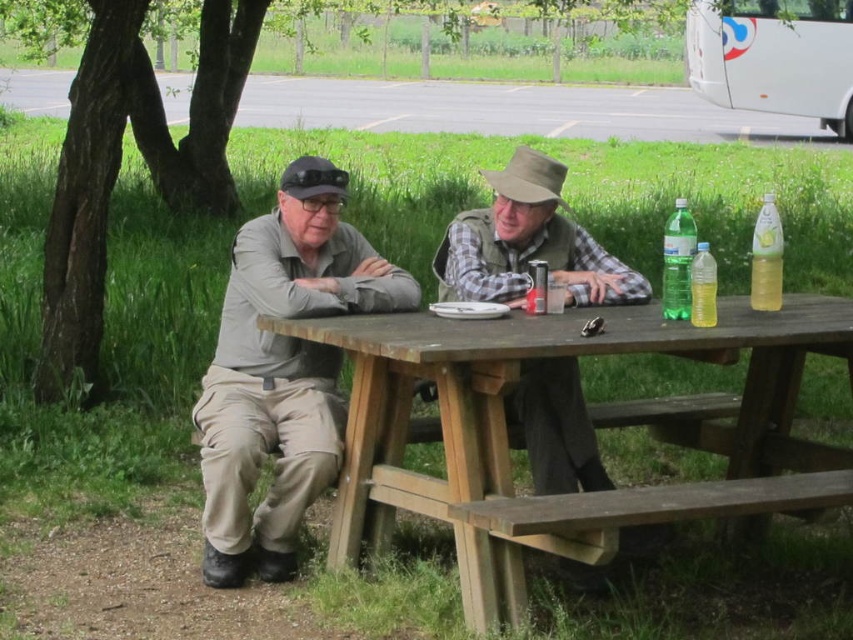
Is point (756, 58) positioned before point (691, 305)?

That is False.

This screenshot has height=640, width=853. Find the location of `white plastic bus at upper right`. white plastic bus at upper right is located at coordinates (775, 58).

Does khaki cotton pants at left appear under translucent yellow bottle at table right?

Yes, khaki cotton pants at left is below translucent yellow bottle at table right.

Can you confirm if khaki cotton pants at left is positioned above translucent yellow bottle at table right?

Actually, khaki cotton pants at left is below translucent yellow bottle at table right.

Is point (321, 221) positioned in front of point (692, 300)?

No.

Identify the location of khaki cotton pants at left. (282, 371).

Can you confirm if matte gray jacket at center is bigger than translucent yellow bottle at table right?

Yes, matte gray jacket at center is bigger than translucent yellow bottle at table right.

Between point (283, 376) and point (700, 307), which one is positioned in front?

Positioned in front is point (700, 307).

Identify the location of matte gray jacket at center. This screenshot has width=853, height=640. (282, 371).